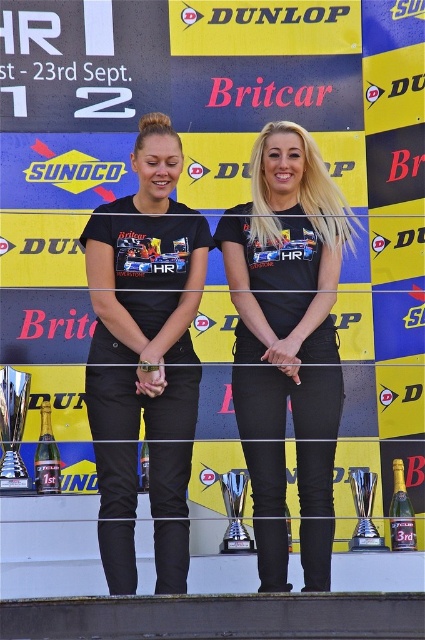
Does black matte pants at center have a lesser width compared to shiny silver trophy at center?

In fact, black matte pants at center might be wider than shiny silver trophy at center.

Is black matte pants at center to the left of shiny silver trophy at center from the viewer's perspective?

Yes, black matte pants at center is to the left of shiny silver trophy at center.

I want to click on black matte pants at center, so click(146, 298).

Between black matte t-shirt at center and black matte pants at center, which one has less height?

black matte pants at center

Can you confirm if black matte t-shirt at center is positioned to the left of black matte pants at center?

Incorrect, black matte t-shirt at center is not on the left side of black matte pants at center.

Image resolution: width=425 pixels, height=640 pixels. What are the coordinates of `black matte t-shirt at center` in the screenshot? It's located at (286, 289).

At what (x,y) coordinates should I click in order to perform the action: click on black matte t-shirt at center. Please return your answer as a coordinate pair (x, y). Looking at the image, I should click on (286, 289).

Between black matte t-shirt at center and shiny silver trophy at center, which one is positioned higher?

black matte t-shirt at center is above.

Can you confirm if black matte t-shirt at center is wider than shiny silver trophy at center?

Yes, black matte t-shirt at center is wider than shiny silver trophy at center.

What are the coordinates of `black matte t-shirt at center` in the screenshot? It's located at (286, 289).